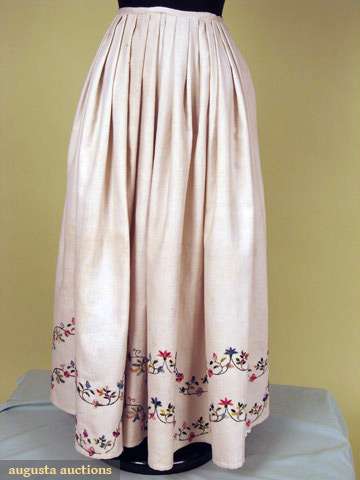
In order to click on solid tan wall in this screenshot , I will do `click(305, 341)`, `click(32, 328)`.